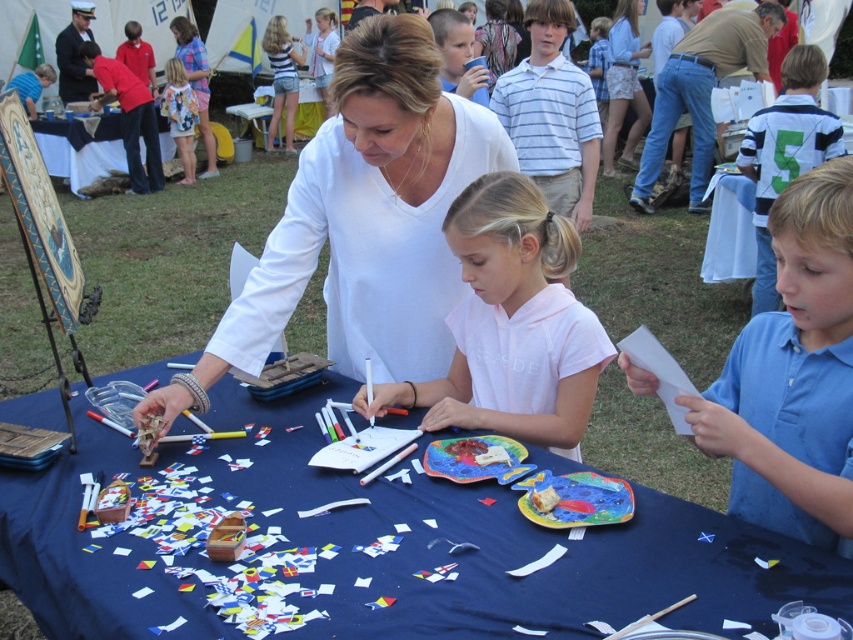
Between point (776, 115) and point (177, 99), which one is positioned behind?

Positioned behind is point (177, 99).

Is striped jersey at center positioned at the back of floral fabric dress at upper left?

That is False.

Between point (766, 182) and point (180, 60), which one is positioned in front?

Point (766, 182) is in front.

The width and height of the screenshot is (853, 640). In order to click on striped jersey at center in this screenshot , I will do `click(785, 152)`.

Is blue fabric table at center below striped jersey at center?

Indeed, blue fabric table at center is positioned under striped jersey at center.

Can you confirm if blue fabric table at center is thinner than striped jersey at center?

In fact, blue fabric table at center might be wider than striped jersey at center.

The image size is (853, 640). Find the location of `blue fabric table at center`. blue fabric table at center is located at coordinates (498, 547).

Is blue smooth shirt at right closer to camera compared to striped jersey at center?

Yes, it is.

Between blue smooth shirt at right and striped jersey at center, which one appears on the right side from the viewer's perspective?

Positioned to the right is striped jersey at center.

Find the location of a particular element. The width and height of the screenshot is (853, 640). blue smooth shirt at right is located at coordinates (793, 376).

The image size is (853, 640). In order to click on blue smooth shirt at right in this screenshot , I will do `click(793, 376)`.